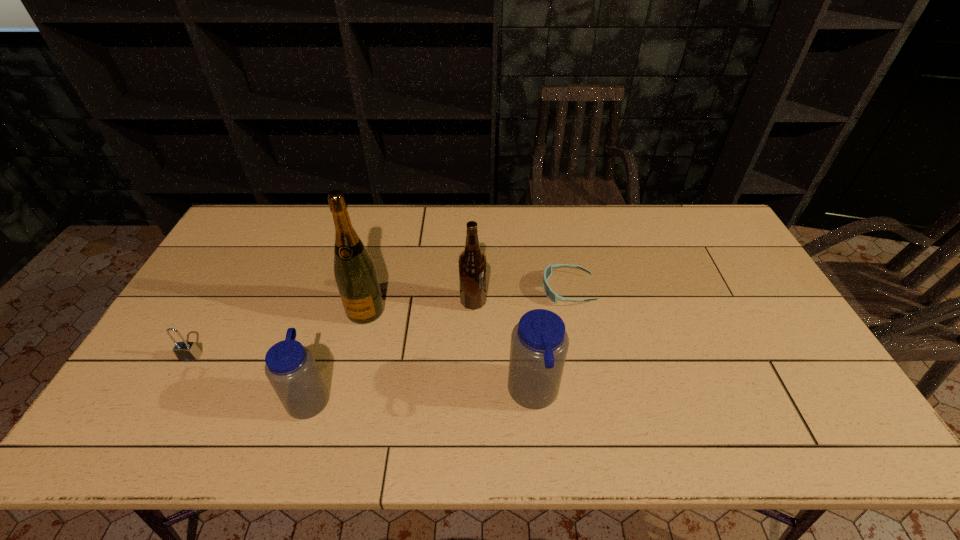
The width and height of the screenshot is (960, 540). Identify the location of the shorter water bottle. (290, 367).

The height and width of the screenshot is (540, 960). Identify the location of the third shortest object. (290, 367).

This screenshot has height=540, width=960. I want to click on the fourth shortest object, so click(539, 342).

Where is `the taller water bottle`? the taller water bottle is located at coordinates (539, 342).

What are the coordinates of `beer bottle` in the screenshot? It's located at (472, 261).

Identify the location of the shortest object. Image resolution: width=960 pixels, height=540 pixels. (551, 295).

Image resolution: width=960 pixels, height=540 pixels. What are the coordinates of `the fifth tallest object` in the screenshot? It's located at (185, 351).

This screenshot has width=960, height=540. Identify the location of the fourth farthest object. (185, 351).

I want to click on wine bottle, so click(355, 273).

The image size is (960, 540). Identify the location of free spot located with a carrying loop on the side of the fourth tallest object. (460, 397).